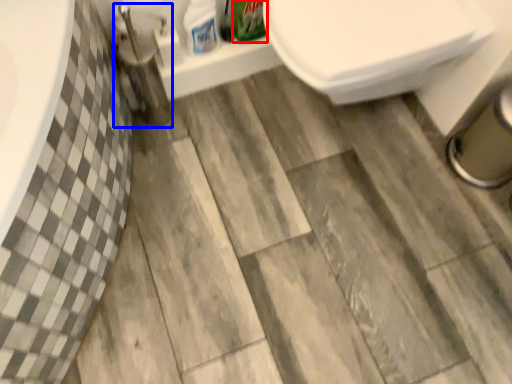
Question: Which object is closer to the camera taking this photo, cleaning product (highlighted by a red box) or plumbing fixture (highlighted by a blue box)?

Choices:
 (A) cleaning product
 (B) plumbing fixture

Answer: (B)